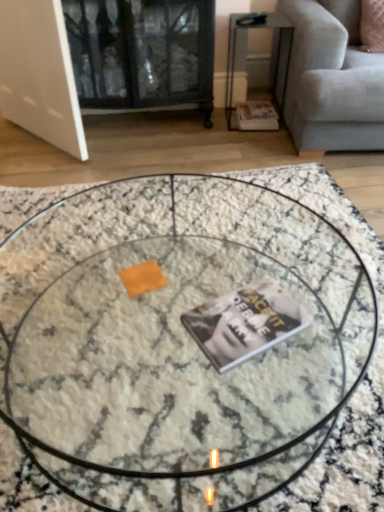
Question: Considering the relative sizes of matte paper magazine at lower right, the 1th magazine in the top-to-bottom sequence, and marble textured coffee table at center in the image provided, is matte paper magazine at lower right, the 1th magazine in the top-to-bottom sequence, wider than marble textured coffee table at center?

Choices:
 (A) yes
 (B) no

Answer: (B)

Question: From a real-world perspective, is matte paper magazine at lower right, the 2th magazine from the left, under marble textured coffee table at center?

Choices:
 (A) yes
 (B) no

Answer: (B)

Question: Is matte paper magazine at lower right, the first magazine positioned from the right, taller than marble textured coffee table at center?

Choices:
 (A) no
 (B) yes

Answer: (A)

Question: Can you confirm if matte paper magazine at lower right, marked as the 2th magazine in a front-to-back arrangement, is shorter than marble textured coffee table at center?

Choices:
 (A) no
 (B) yes

Answer: (B)

Question: Can you confirm if matte paper magazine at lower right, which appears as the 2th magazine when ordered from the bottom, is bigger than marble textured coffee table at center?

Choices:
 (A) no
 (B) yes

Answer: (A)

Question: Considering the relative positions of matte paper magazine at lower right, the 1th magazine in the top-to-bottom sequence, and marble textured coffee table at center in the image provided, is matte paper magazine at lower right, the 1th magazine in the top-to-bottom sequence, to the right of marble textured coffee table at center from the viewer's perspective?

Choices:
 (A) no
 (B) yes

Answer: (B)

Question: Is metallic silver side table at upper right next to matte paper magazine at lower right, marked as the 2th magazine in a front-to-back arrangement, and touching it?

Choices:
 (A) no
 (B) yes

Answer: (A)

Question: Considering the relative sizes of metallic silver side table at upper right and matte paper magazine at lower right, the 2th magazine from the left, in the image provided, is metallic silver side table at upper right bigger than matte paper magazine at lower right, the 2th magazine from the left,?

Choices:
 (A) no
 (B) yes

Answer: (B)

Question: Is metallic silver side table at upper right turned away from matte paper magazine at lower right, the 1th magazine in the top-to-bottom sequence?

Choices:
 (A) no
 (B) yes

Answer: (A)

Question: Is metallic silver side table at upper right smaller than matte paper magazine at lower right, the 1th magazine in the top-to-bottom sequence?

Choices:
 (A) no
 (B) yes

Answer: (A)

Question: From the image's perspective, does metallic silver side table at upper right appear higher than matte paper magazine at lower right, the 1th magazine in the top-to-bottom sequence?

Choices:
 (A) no
 (B) yes

Answer: (B)

Question: Is metallic silver side table at upper right to the right of matte paper magazine at lower right, marked as the 2th magazine in a front-to-back arrangement, from the viewer's perspective?

Choices:
 (A) no
 (B) yes

Answer: (A)

Question: Is metallic silver side table at upper right bigger than marble textured coffee table at center?

Choices:
 (A) no
 (B) yes

Answer: (A)